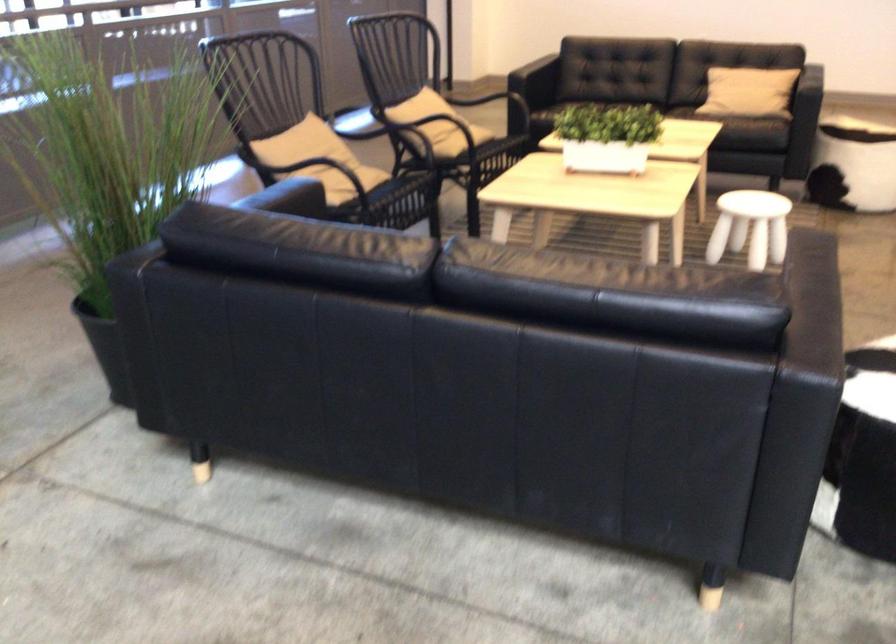
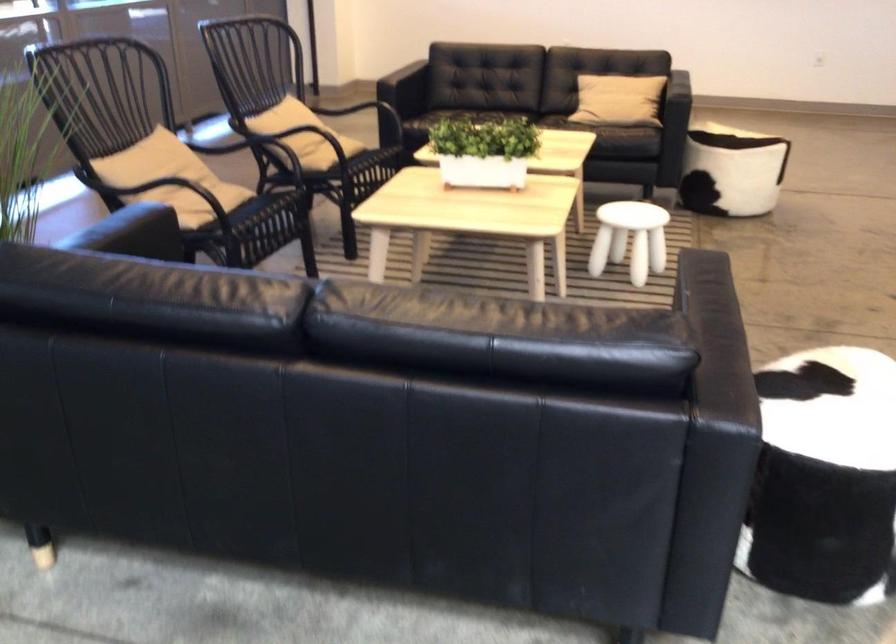
Question: Which direction would the cameraman need to move to produce the second image? Reply with the corresponding letter.

Choices:
 (A) Left
 (B) Right
 (C) Forward
 (D) Backward

Answer: (C)